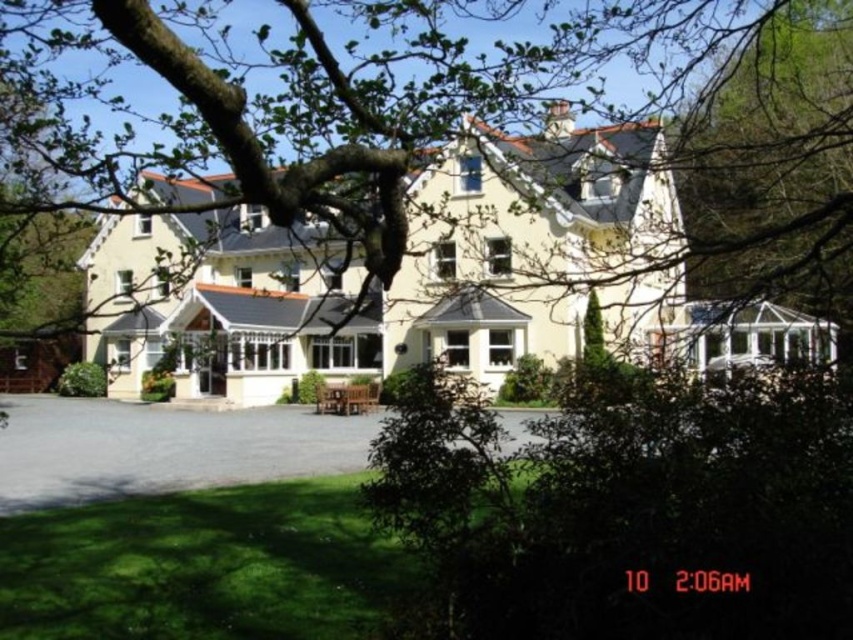
You are a visitor arriving at the property and need to park your car. The yellow matte building at center has an entrance on its left side. Can you park your car on the gray asphalt driveway at lower center without blocking the entrance?

The yellow matte building at center is to the right of gray asphalt driveway at lower center, so parking on the gray asphalt driveway at lower center would place the car to the left of the building. Since the entrance is on the left side of the building, parking there might block the entrance. Choose another parking spot to avoid obstruction.

Looking at this image, you are a delivery person trying to park your truck in the gray asphalt driveway at lower center. The truck is 3 meters tall. Can you safely park there without hitting the yellow matte building at center?

The yellow matte building at center is taller than the gray asphalt driveway at lower center. Since the building is taller than the driveway, the truck can safely park there as the building height does not restrict the driveway height.